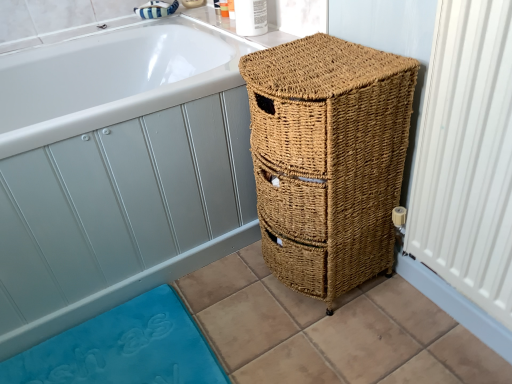
Question: Is white glossy bathtub at upper left not inside woven brown basket at right?

Choices:
 (A) no
 (B) yes

Answer: (B)

Question: Does white glossy bathtub at upper left have a larger size compared to woven brown basket at right?

Choices:
 (A) yes
 (B) no

Answer: (A)

Question: Is white glossy bathtub at upper left at the left side of woven brown basket at right?

Choices:
 (A) no
 (B) yes

Answer: (B)

Question: Is white glossy bathtub at upper left turned away from woven brown basket at right?

Choices:
 (A) yes
 (B) no

Answer: (B)

Question: Considering the relative positions of white glossy bathtub at upper left and woven brown basket at right in the image provided, is white glossy bathtub at upper left to the right of woven brown basket at right from the viewer's perspective?

Choices:
 (A) yes
 (B) no

Answer: (B)

Question: Is white glossy bathtub at upper left positioned far away from woven brown basket at right?

Choices:
 (A) no
 (B) yes

Answer: (A)

Question: Can you confirm if white textured radiator at right is positioned to the right of woven brown basket at right?

Choices:
 (A) no
 (B) yes

Answer: (B)

Question: From the image's perspective, does white textured radiator at right appear lower than woven brown basket at right?

Choices:
 (A) yes
 (B) no

Answer: (B)

Question: Is white textured radiator at right closer to camera compared to woven brown basket at right?

Choices:
 (A) yes
 (B) no

Answer: (A)

Question: Can you confirm if white textured radiator at right is taller than woven brown basket at right?

Choices:
 (A) yes
 (B) no

Answer: (A)

Question: Is white textured radiator at right oriented towards woven brown basket at right?

Choices:
 (A) yes
 (B) no

Answer: (B)

Question: Does white textured radiator at right have a lesser height compared to woven brown basket at right?

Choices:
 (A) no
 (B) yes

Answer: (A)

Question: From a real-world perspective, is white glossy bathtub at upper left physically above white textured radiator at right?

Choices:
 (A) yes
 (B) no

Answer: (B)